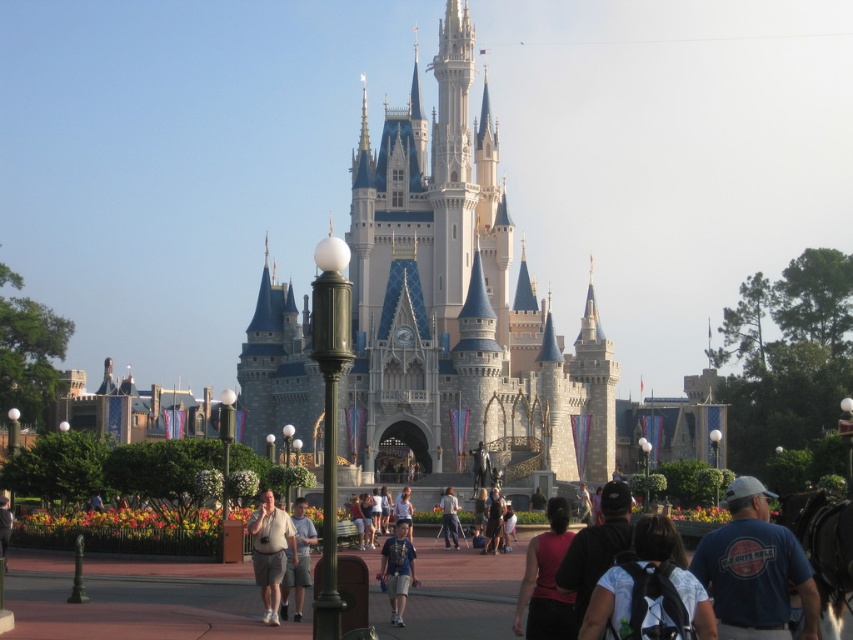
Question: Does white stone castle at center have a lesser width compared to dark blue t-shirt at lower right?

Choices:
 (A) no
 (B) yes

Answer: (A)

Question: Which of these objects is positioned closest to the matte pink shirt at lower right?

Choices:
 (A) dark blue jeans at center
 (B) dark blue backpack at center

Answer: (B)

Question: Can you confirm if dark blue t-shirt at lower right is positioned above blue denim shorts at center?

Choices:
 (A) yes
 (B) no

Answer: (A)

Question: Which point is farther to the camera?

Choices:
 (A) light brown fabric shorts at center
 (B) dark blue jeans at center
 (C) white fabric shirt at center
 (D) blue denim shorts at center

Answer: (B)

Question: Can you confirm if dark blue jeans at center is smaller than light blue denim shorts at center?

Choices:
 (A) no
 (B) yes

Answer: (B)

Question: Which point is closer to the camera?

Choices:
 (A) (550, 620)
 (B) (759, 580)
 (C) (283, 532)

Answer: (B)